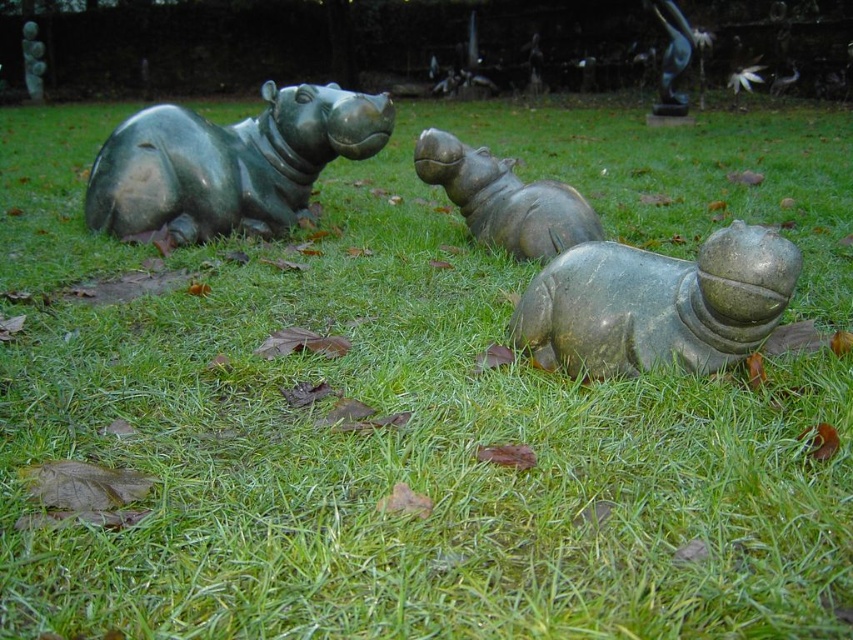
You are standing at the center of the grassy area and want to locate the bronze statue at upper right. Based on the coordinates provided, in which direction should you move to reach it?

The bronze statue at upper right is located at coordinates point (672, 56), so you should move towards the upper right direction from your current position at the center of the grassy area.

You are a visitor in the sculpture garden and want to take a photo of both the bronze statue at upper right and the green polished stone hippo at upper left. Which direction should you walk to ensure both are in your camera frame?

You should walk to the left so that both the bronze statue at upper right and the green polished stone hippo at upper left are within your camera frame since the bronze statue at upper right is to the right of the green polished stone hippo at upper left.

You are an art curator planning to arrange these sculptures in a new exhibition. You need to place the green polished hippo at left and the green polished stone hippo at upper left such that the taller one is positioned at the back for better visibility. Which hippo should be placed at the back?

The green polished stone hippo at upper left is taller than the green polished hippo at left, so it should be placed at the back to ensure visibility.